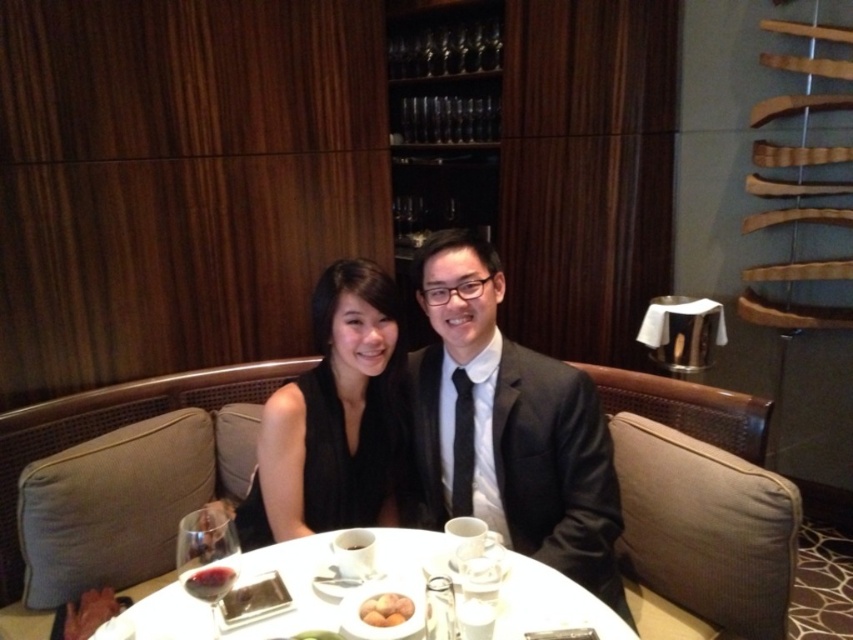
Between matte black suit at center and smooth yellow eggs at table center, which one has less height?

smooth yellow eggs at table center is shorter.

Is the position of matte black suit at center more distant than that of smooth yellow eggs at table center?

Yes, matte black suit at center is further from the viewer.

Is point (604, 445) closer to camera compared to point (387, 605)?

No.

Identify the location of matte black suit at center. This screenshot has height=640, width=853. click(x=506, y=426).

Is matte black suit at center positioned behind white glossy table at center?

Yes, matte black suit at center is behind white glossy table at center.

Which of these two, matte black suit at center or white glossy table at center, stands taller?

matte black suit at center is taller.

I want to click on matte black suit at center, so click(506, 426).

Locate an element on the screen. This screenshot has height=640, width=853. matte black suit at center is located at coordinates (506, 426).

Who is more distant from viewer, (x=393, y=392) or (x=370, y=618)?

Positioned behind is point (x=393, y=392).

In the scene shown: Does black satin dress at center appear on the left side of smooth yellow eggs at table center?

Correct, you'll find black satin dress at center to the left of smooth yellow eggs at table center.

Which is in front, point (326, 364) or point (378, 620)?

Point (378, 620) is more forward.

This screenshot has width=853, height=640. I want to click on black satin dress at center, so click(x=334, y=419).